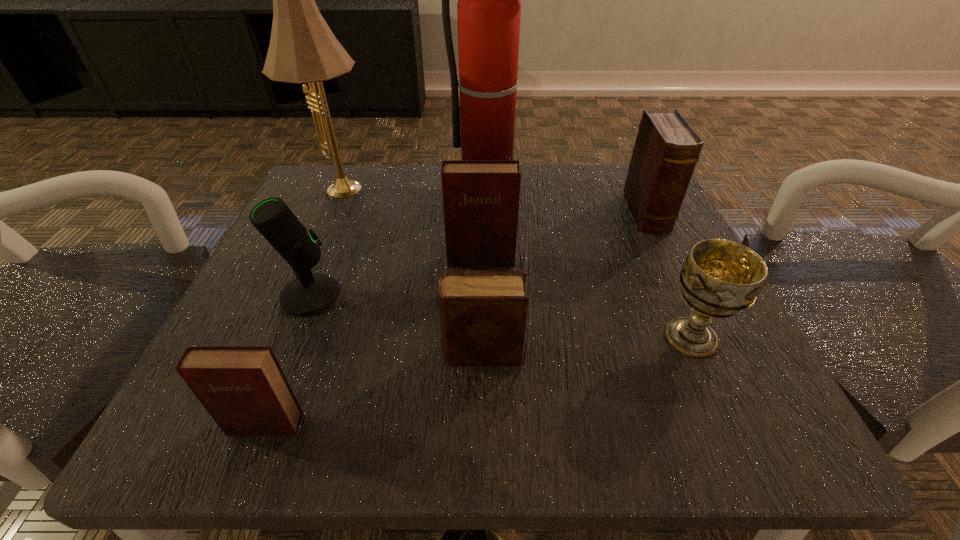
Where is `the left reddish-brown diary`? the left reddish-brown diary is located at coordinates (243, 388).

Locate an element on the screen. Image resolution: width=960 pixels, height=540 pixels. the smaller reddish-brown diary is located at coordinates (243, 388).

The height and width of the screenshot is (540, 960). I want to click on free region located 0.060m with the nozzle and gauge on the fire extinguisher, so click(491, 220).

Locate an element on the screen. Image resolution: width=960 pixels, height=540 pixels. free space located on the right of the beige lampshade is located at coordinates (506, 193).

At what (x,y) coordinates should I click in order to perform the action: click on vacant space located on the spine side of the right brown diary. Please return your answer as a coordinate pair (x, y). This screenshot has width=960, height=540. Looking at the image, I should click on (721, 368).

Find the location of `vacant space located on the front cover of the fourth farthest object`. vacant space located on the front cover of the fourth farthest object is located at coordinates (481, 390).

Locate an element on the screen. This screenshot has height=540, width=960. vacant space located on the back of the microphone is located at coordinates (356, 179).

The image size is (960, 540). In order to click on vacant space situated on the back of the chalice in this screenshot , I will do `click(666, 281)`.

I want to click on vacant space located 0.220m on the spine side of the nearer brown diary, so click(x=284, y=353).

Identify the location of blank space located 0.070m on the spine side of the nearer brown diary. (392, 353).